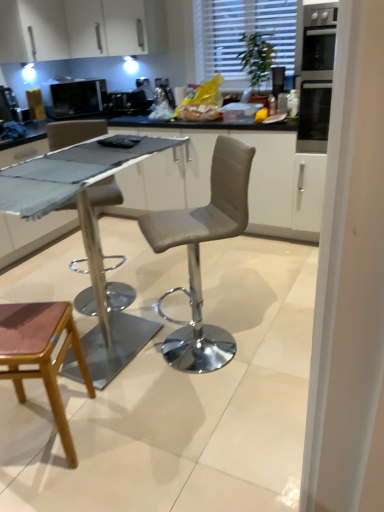
What are the coordinates of `unoccupied area in front of pink leather stool at lower left` in the screenshot? It's located at (50, 489).